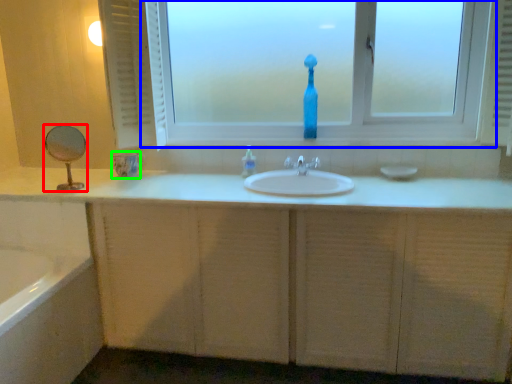
Question: Estimate the real-world distances between objects in this image. Which object is farther from mirror (highlighted by a red box), window (highlighted by a blue box) or glass vase (highlighted by a green box)?

Choices:
 (A) window
 (B) glass vase

Answer: (A)